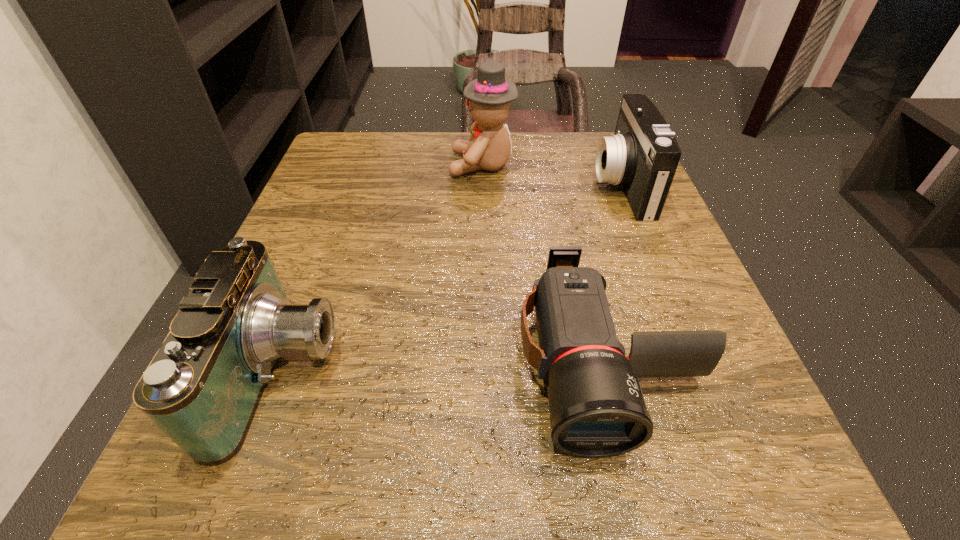
In order to click on free region at the right edge of the desktop in this screenshot , I will do `click(656, 290)`.

In the image, there is a desktop. Where is `vacant space at the near right corner`? This screenshot has width=960, height=540. vacant space at the near right corner is located at coordinates (766, 515).

This screenshot has width=960, height=540. In order to click on vacant point located between the farthest camcorder and the tallest object in this screenshot , I will do `click(552, 175)`.

You are a GUI agent. You are given a task and a screenshot of the screen. Output one action in this format:
    pyautogui.click(x=<x>, y=<y>)
    Task: Click on the unoccupied area between the shortest camcorder and the rag_doll
    
    Given the screenshot: What is the action you would take?
    pyautogui.click(x=544, y=262)

At what (x,y) coordinates should I click in order to perform the action: click on free area in between the rag_doll and the farthest camcorder. Please return your answer as a coordinate pair (x, y). Looking at the image, I should click on (552, 175).

Locate an element on the screen. free space between the shortest camcorder and the farthest camcorder is located at coordinates (613, 272).

Locate an element on the screen. This screenshot has height=540, width=960. vacant area that lies between the shortest camcorder and the farthest camcorder is located at coordinates (613, 272).

This screenshot has width=960, height=540. What are the coordinates of `free spot between the shortest object and the farthest camcorder` in the screenshot? It's located at (613, 272).

Locate an element on the screen. vacant region between the tallest object and the farthest camcorder is located at coordinates (552, 175).

Identify the location of vacant region between the shortest object and the tallest object. (544, 262).